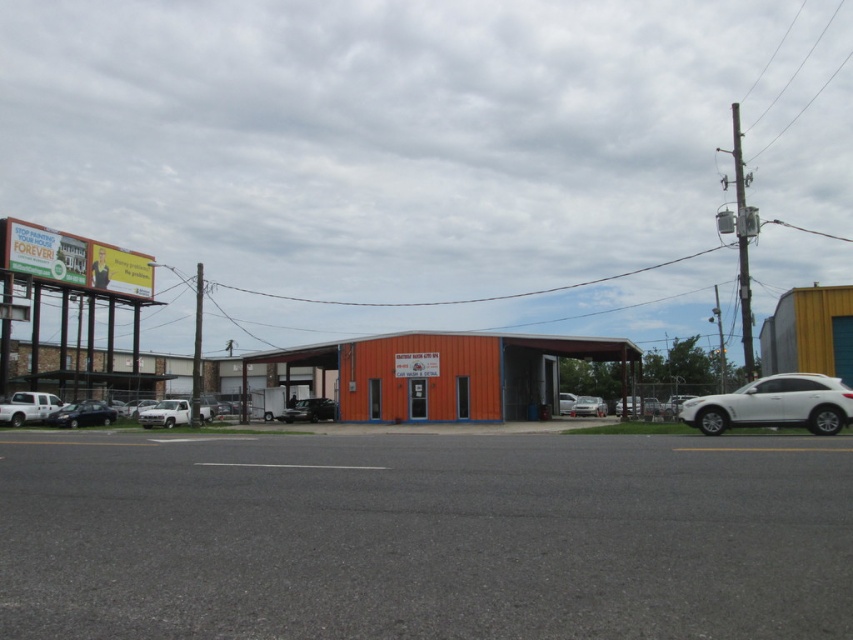
Between point (314, 419) and point (601, 416), which one is positioned in front?

Positioned in front is point (314, 419).

Which is behind, point (297, 420) or point (581, 397)?

Positioned behind is point (581, 397).

Identify the location of shiny black van at center. (308, 410).

Does point (97, 422) come behind point (566, 392)?

No, it is in front of (566, 392).

Between point (86, 404) and point (569, 410), which one is positioned in front?

Positioned in front is point (86, 404).

The width and height of the screenshot is (853, 640). In order to click on shiny black sedan at lower left in this screenshot , I will do `click(82, 413)`.

Locate an element on the screen. shiny black sedan at lower left is located at coordinates (82, 413).

Is white matte suv at right bigger than white matte suv at center?

Incorrect, white matte suv at right is not larger than white matte suv at center.

Between white matte suv at right and white matte suv at center, which one has less height?

Standing shorter between the two is white matte suv at right.

At what (x,y) coordinates should I click in order to perform the action: click on white matte suv at right. Please return your answer as a coordinate pair (x, y). This screenshot has height=640, width=853. Looking at the image, I should click on (775, 404).